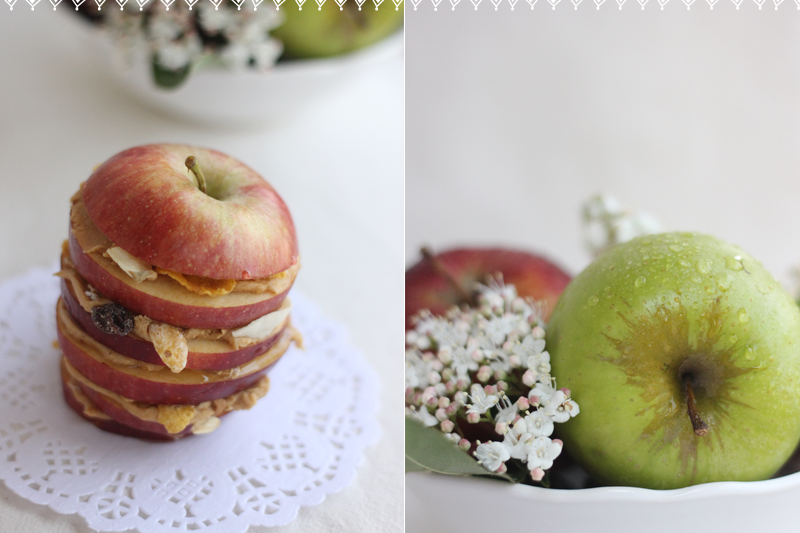
The height and width of the screenshot is (533, 800). I want to click on decorative cloth, so click(x=158, y=466).